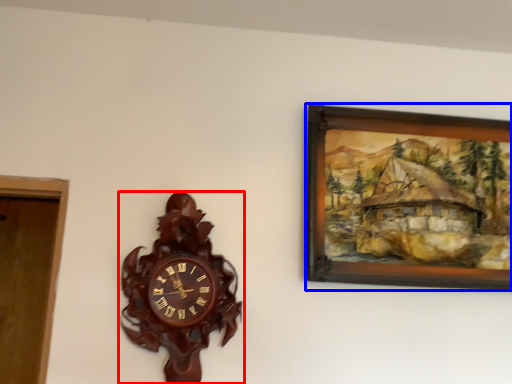
Question: Which object appears farthest to the camera in this image, wall clock (highlighted by a red box) or picture frame (highlighted by a blue box)?

Choices:
 (A) wall clock
 (B) picture frame

Answer: (B)